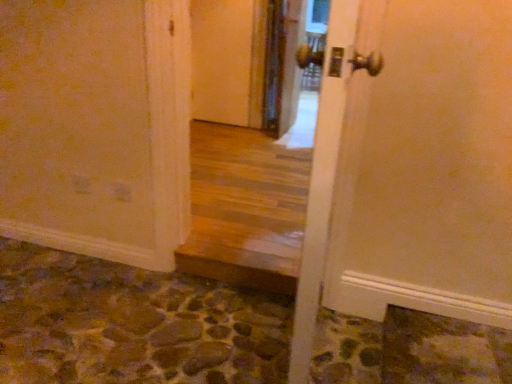
Describe the element at coordinates (249, 203) in the screenshot. The width and height of the screenshot is (512, 384). I see `wooden at center` at that location.

What is the approximate width of wooden at center?

9.47 inches.

At what (x,y) coordinates should I click in order to perform the action: click on wooden at center. Please return your answer as a coordinate pair (x, y). The height and width of the screenshot is (384, 512). Looking at the image, I should click on (249, 203).

Where is `wooden at center`? The width and height of the screenshot is (512, 384). wooden at center is located at coordinates (249, 203).